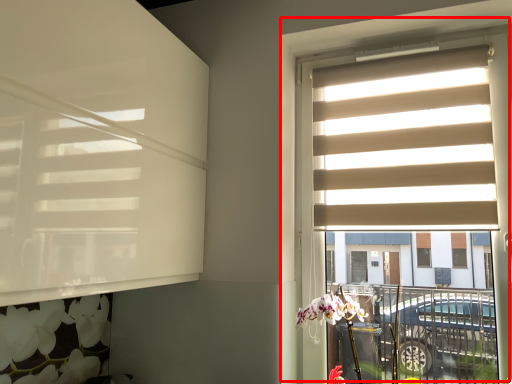
Question: Considering the relative positions of window (annotated by the red box) and window blind in the image provided, where is window (annotated by the red box) located with respect to the staircase?

Choices:
 (A) right
 (B) left

Answer: (A)